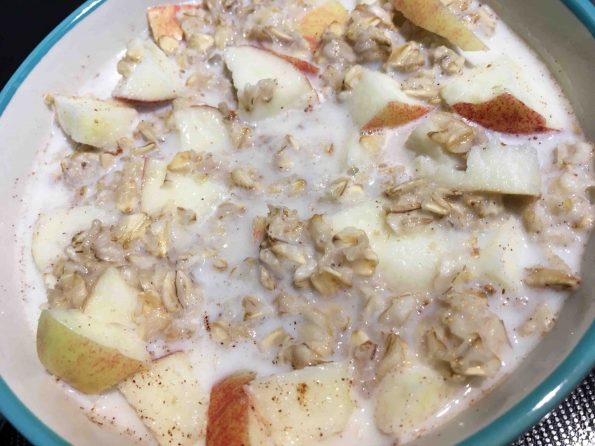
At what (x,y) coordinates should I click in order to perform the action: click on blue rim of bowl. Please return your answer as a coordinate pair (x, y). Looking at the image, I should click on (64, 23).